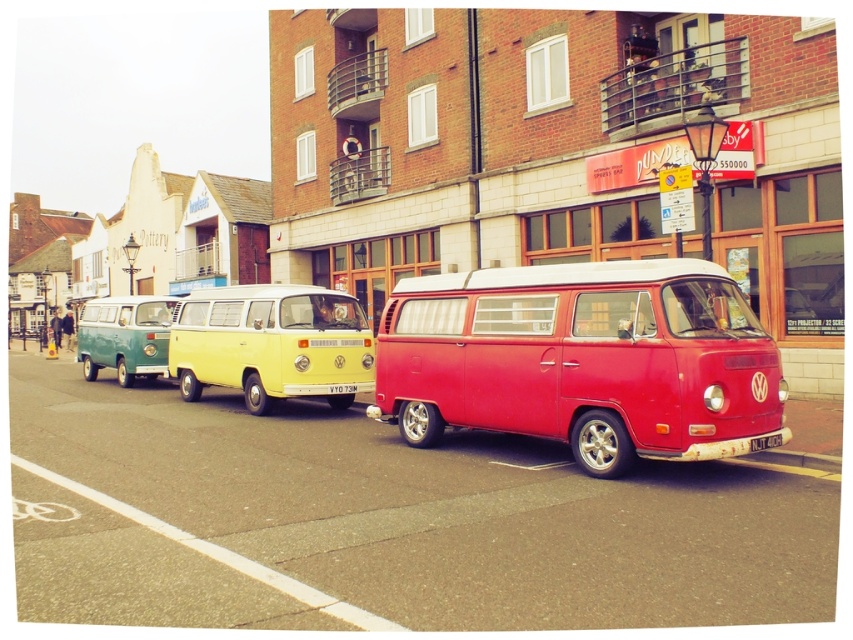
Is shiny red van at center bigger than pastel yellow van at center?

No.

Can you confirm if shiny red van at center is taller than pastel yellow van at center?

No.

Is point (492, 369) more distant than point (180, 376)?

No, it is not.

Identify the location of shiny red van at center. (584, 360).

Which is more to the left, shiny red van at center or teal matte van at left?

Positioned to the left is teal matte van at left.

Is shiny red van at center above teal matte van at left?

Incorrect, shiny red van at center is not positioned above teal matte van at left.

What do you see at coordinates (584, 360) in the screenshot?
I see `shiny red van at center` at bounding box center [584, 360].

Where is `shiny red van at center`? This screenshot has height=640, width=853. shiny red van at center is located at coordinates (584, 360).

Which is behind, point (235, 310) or point (149, 376)?

Positioned behind is point (149, 376).

Is pastel yellow van at center in front of teal matte van at left?

Yes, pastel yellow van at center is closer to the viewer.

At what (x,y) coordinates should I click in order to perform the action: click on pastel yellow van at center. Please return your answer as a coordinate pair (x, y). Image resolution: width=853 pixels, height=640 pixels. Looking at the image, I should click on (271, 342).

This screenshot has width=853, height=640. What are the coordinates of `pastel yellow van at center` in the screenshot? It's located at [x=271, y=342].